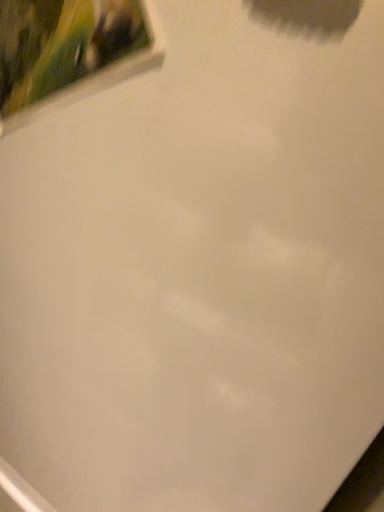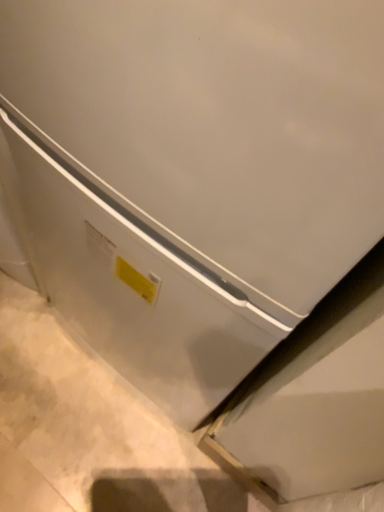
Question: Which way did the camera rotate in the video?

Choices:
 (A) rotated left
 (B) rotated right

Answer: (A)